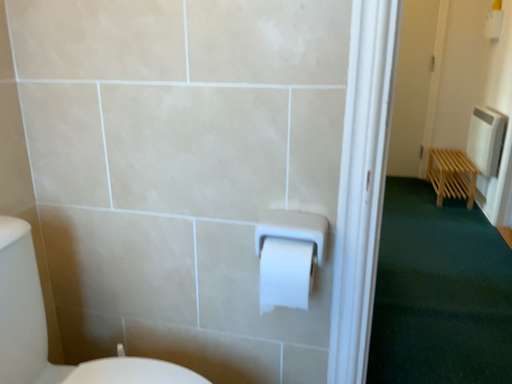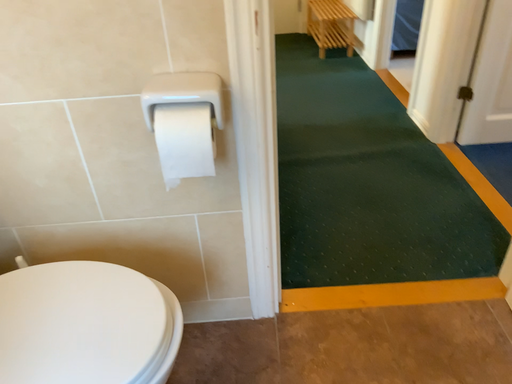
Question: How did the camera likely rotate when shooting the video?

Choices:
 (A) rotated right
 (B) rotated left

Answer: (A)